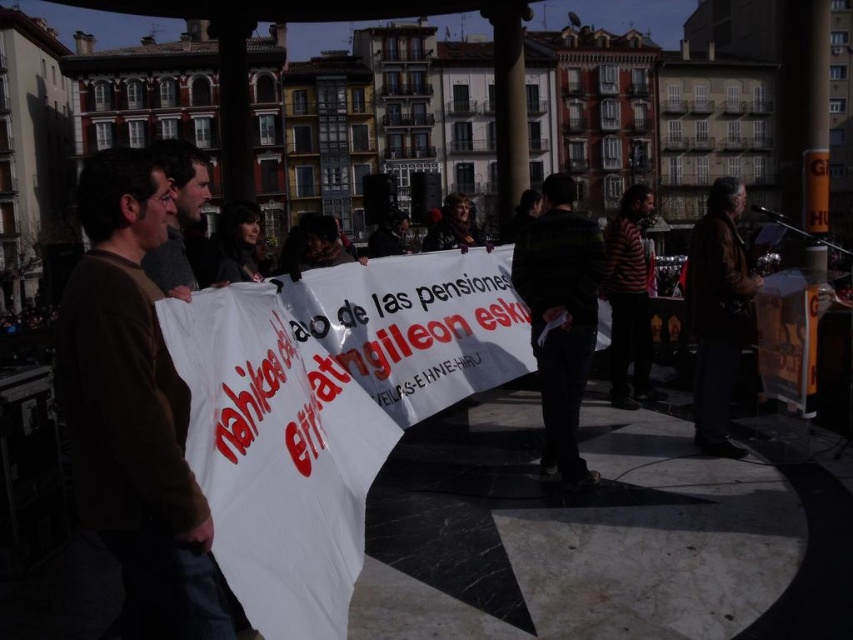
Is point (86, 460) behind point (692, 241)?

That is False.

Who is more distant from viewer, (144, 292) or (706, 312)?

Point (706, 312)

The width and height of the screenshot is (853, 640). Find the location of `brown sweater at left`. brown sweater at left is located at coordinates (132, 408).

Based on the photo, does dark green sweater at center have a greater height compared to gray knit sweater at left?

Indeed, dark green sweater at center has a greater height compared to gray knit sweater at left.

Identify the location of dark green sweater at center. This screenshot has width=853, height=640. [560, 316].

Which is behind, point (581, 248) or point (173, 241)?

The point (581, 248) is more distant.

Where is `dark green sweater at center`? This screenshot has height=640, width=853. dark green sweater at center is located at coordinates (560, 316).

Which is more to the right, brown leather jacket at right or gray knit sweater at left?

brown leather jacket at right

Can you confirm if brown leather jacket at right is taller than gray knit sweater at left?

Correct, brown leather jacket at right is much taller as gray knit sweater at left.

Is point (694, 394) more distant than point (163, 273)?

Yes, point (694, 394) is behind point (163, 273).

The height and width of the screenshot is (640, 853). Find the location of `brown leather jacket at right`. brown leather jacket at right is located at coordinates (718, 312).